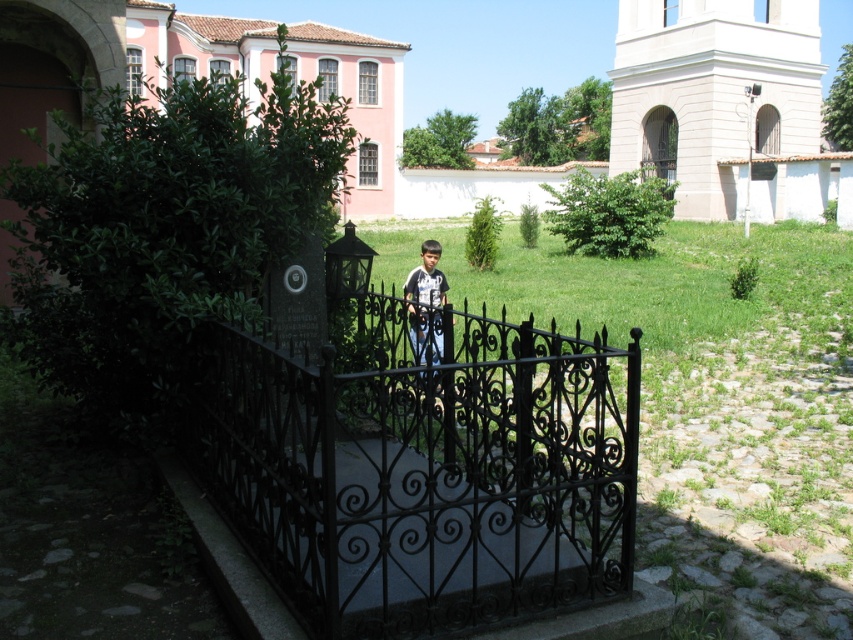
Is point (473, 472) behind point (718, 188)?

No, (473, 472) is closer to viewer.

Does black wrought iron gate at center have a greater width compared to white stone church at upper right?

In fact, black wrought iron gate at center might be narrower than white stone church at upper right.

Does point (383, 580) come farther from viewer compared to point (817, 76)?

No.

What are the coordinates of `black wrought iron gate at center` in the screenshot? It's located at coord(422,468).

Who is more distant from viewer, (635, 372) or (438, 282)?

Point (438, 282)

Which is more to the left, black wrought iron gate at center or matte black shirt at center?

black wrought iron gate at center

Is point (403, 349) positioned before point (419, 310)?

That is False.

The image size is (853, 640). I want to click on black wrought iron gate at center, so [x=422, y=468].

Which is more to the left, white stone church at upper right or matte black shirt at center?

From the viewer's perspective, matte black shirt at center appears more on the left side.

I want to click on white stone church at upper right, so click(x=726, y=104).